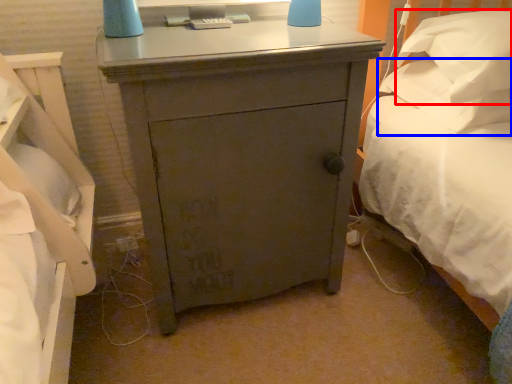
Question: Which object appears farthest to the camera in this image, pillow (highlighted by a red box) or pillow (highlighted by a blue box)?

Choices:
 (A) pillow
 (B) pillow

Answer: (B)